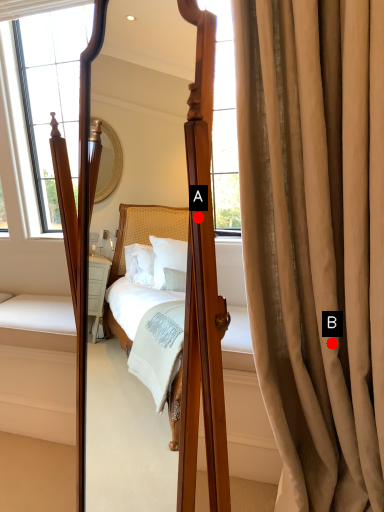
Question: Two points are circled on the image, labeled by A and B beside each circle. Which point is closer to the camera?

Choices:
 (A) A is closer
 (B) B is closer

Answer: (A)